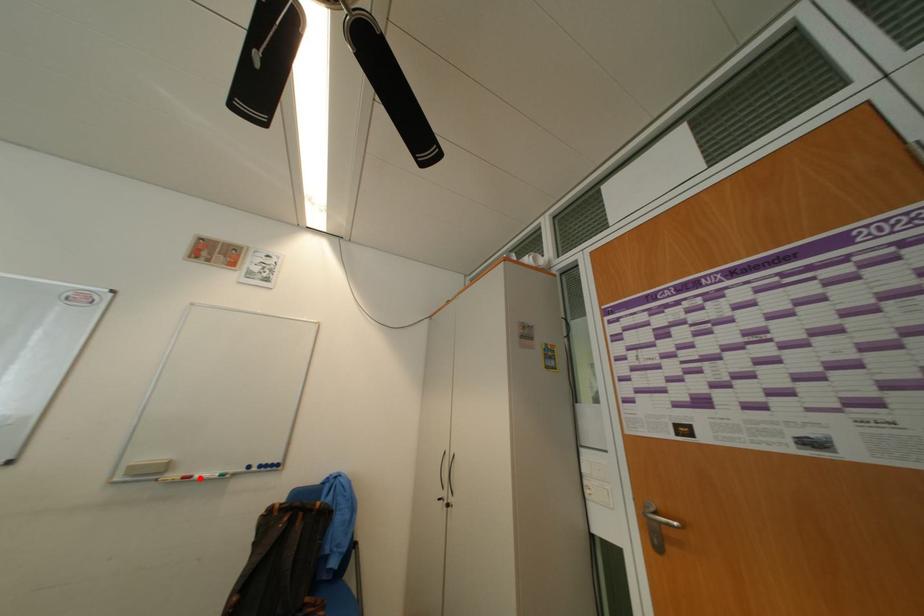
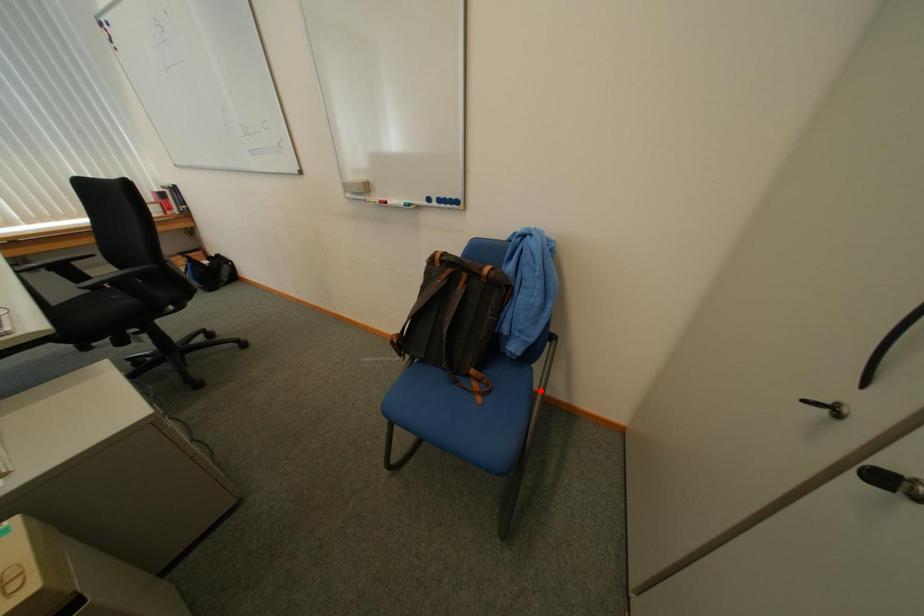
I am providing you with two images of the same scene from different viewpoints. A red point is marked on the first image and another point is marked on the second image. Is the red point in image1 aligned with the point shown in image2?

No